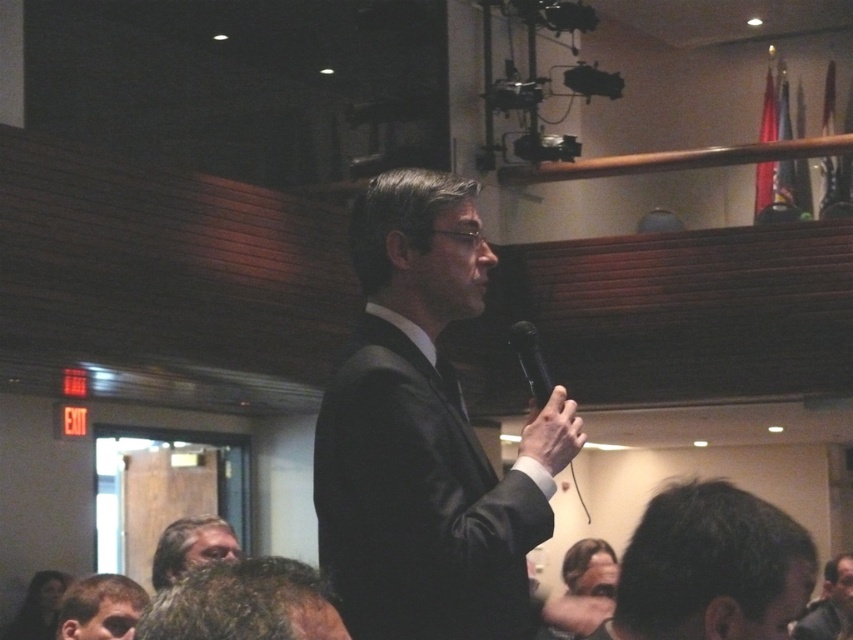
You are a photographer taking a picture of the scene. The grayish brown hair at lower center and the black plastic microphone at center are both in the frame. Which object is larger in the photo?

The grayish brown hair at lower center is bigger than the black plastic microphone at center in the photo.

You are a photographer positioned at the camera. You want to capture a closeup shot of the grayish brown hair at lower center. Given that your camera has a minimum focusing distance of 2 meters, can you achieve this without moving closer?

The grayish brown hair at lower center is 3.41 meters away from the camera. Since the minimum focusing distance is 2 meters, the camera can focus on the grayish brown hair at lower center as it is beyond the minimum required distance.

From the picture: What is the exact location of the grayish brown hair at lower center in the image?

The grayish brown hair at lower center is located at point (190, 547).